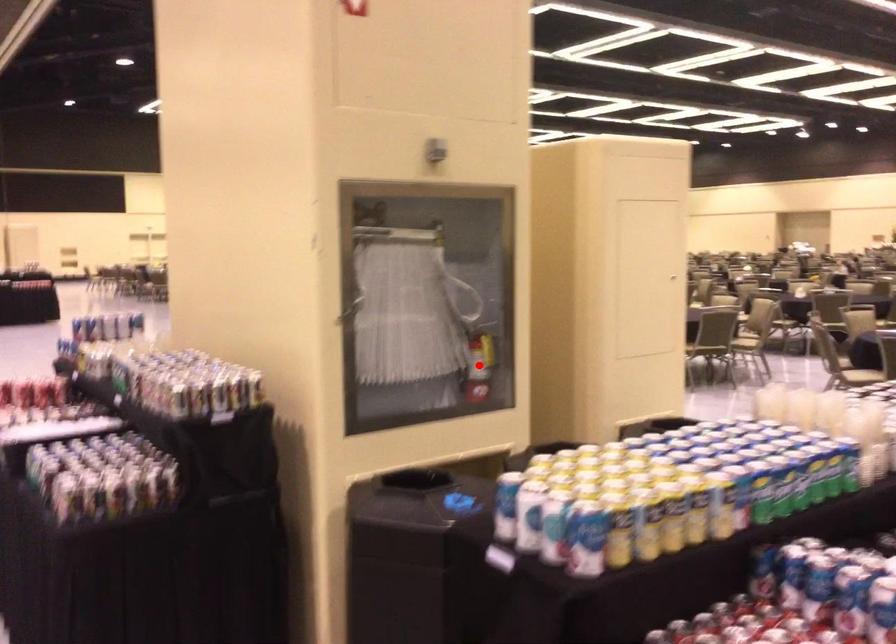
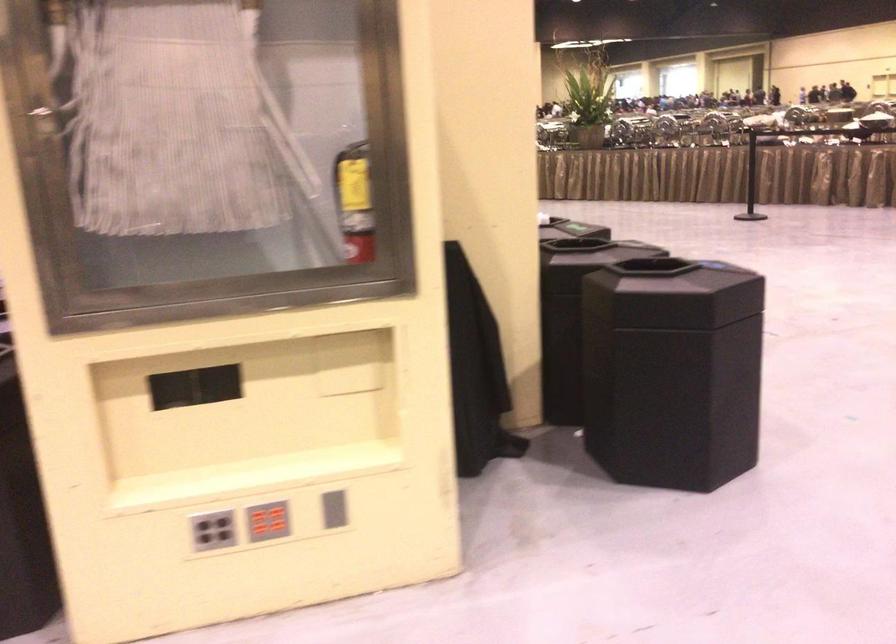
Question: I am providing you with two images of the same scene from different viewpoints. A red point is marked on the first image. Can you still see the location of the red point in image 2?

Choices:
 (A) Yes
 (B) No

Answer: (B)